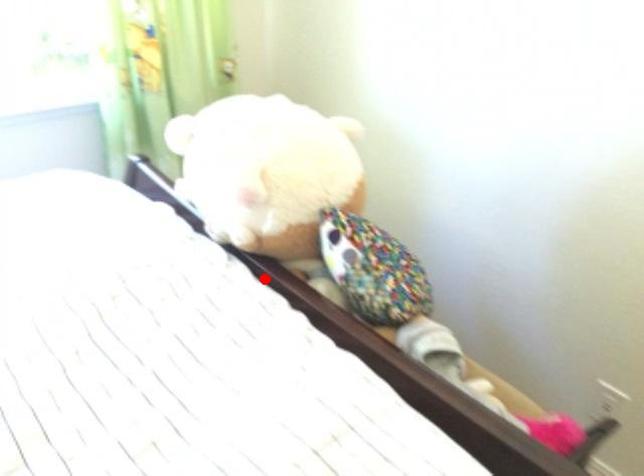
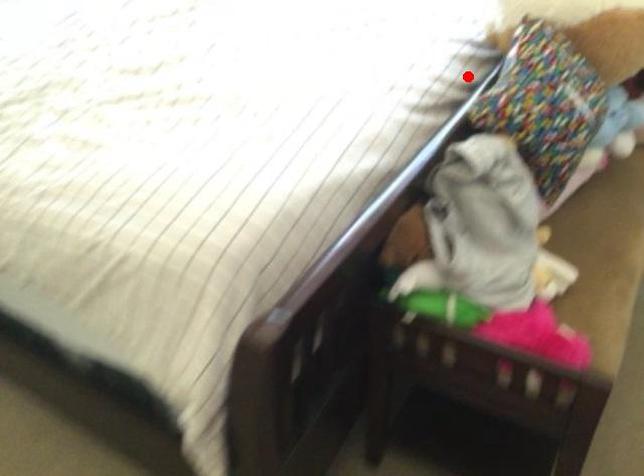
I am providing you with two images of the same scene from different viewpoints. A red point is marked on the first image and another point is marked on the second image. Is the red point in image1 aligned with the point shown in image2?

Yes